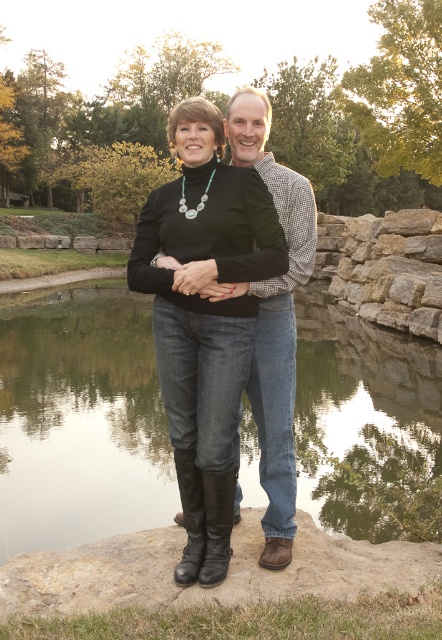
Question: Is transparent glass water at center thinner than black leather boots at center?

Choices:
 (A) yes
 (B) no

Answer: (B)

Question: Is transparent glass water at center above black leather boots at center?

Choices:
 (A) yes
 (B) no

Answer: (B)

Question: Does transparent glass water at center have a larger size compared to black leather boots at center?

Choices:
 (A) yes
 (B) no

Answer: (A)

Question: Which point appears closest to the camera in this image?

Choices:
 (A) (372, 349)
 (B) (220, 237)

Answer: (B)